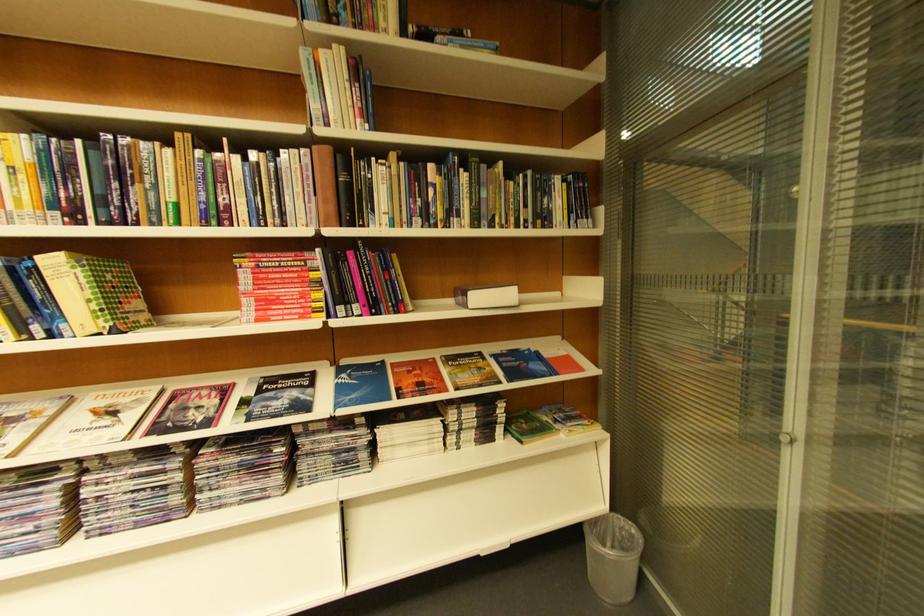
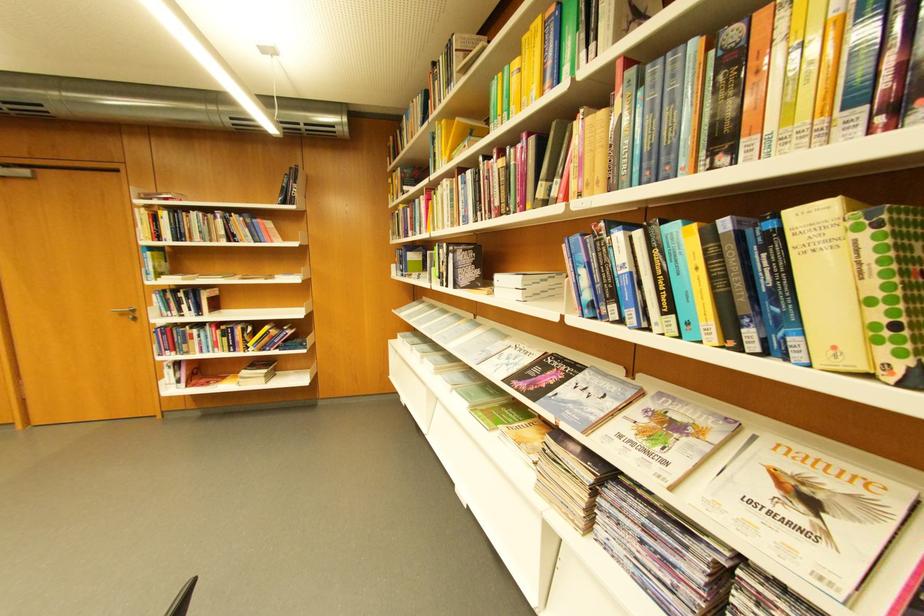
Locate, in the second image, the point that corresponds to (113,405) in the first image.

(800, 469)